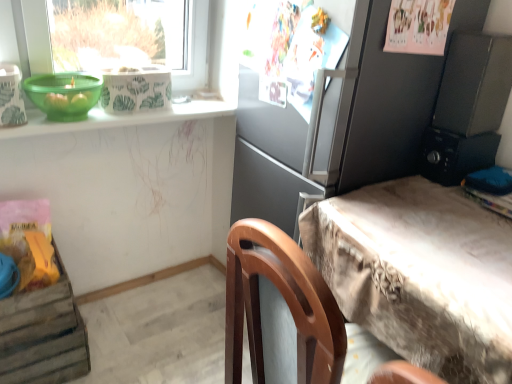
What are the coordinates of `matte gray refrigerator at center` in the screenshot? It's located at (346, 132).

Locate an element on the screen. Image resolution: width=512 pixels, height=384 pixels. textured beige desk at right is located at coordinates (420, 274).

What do you see at coordinates (64, 94) in the screenshot? I see `green plastic bowl at upper left` at bounding box center [64, 94].

This screenshot has height=384, width=512. What do you see at coordinates (455, 155) in the screenshot?
I see `black plastic radio at upper right` at bounding box center [455, 155].

Find the location of a particular element. Image resolution: width=512 pixels, height=384 pixels. matte gray refrigerator at center is located at coordinates (346, 132).

In the scene shown: From a real-world perspective, who is located lower, black plastic radio at upper right or green plastic bowl at upper left?

In real-world perspective, black plastic radio at upper right is lower.

At what (x,y) coordinates should I click in order to perform the action: click on appliance on the right of green plastic bowl at upper left. Please return your answer as a coordinate pair (x, y). Looking at the image, I should click on (455, 155).

How many degrees apart are the facing directions of black plastic radio at upper right and green plastic bowl at upper left?

They differ by 98.5 degrees in their facing directions.

Between black plastic radio at upper right and green plastic bowl at upper left, which one has larger width?

With larger width is black plastic radio at upper right.

Is matte gray refrigerator at center shorter than green plastic bowl at upper left?

Incorrect, the height of matte gray refrigerator at center does not fall short of that of green plastic bowl at upper left.

Is matte gray refrigerator at center spatially inside green plastic bowl at upper left, or outside of it?

matte gray refrigerator at center is spatially situated outside green plastic bowl at upper left.

Can you tell me how much matte gray refrigerator at center and green plastic bowl at upper left differ in facing direction?

91.3 degrees separate the facing orientations of matte gray refrigerator at center and green plastic bowl at upper left.

Who is more distant, matte gray refrigerator at center or green plastic bowl at upper left?

green plastic bowl at upper left.

In terms of width, does wooden crate at lower left look wider or thinner when compared to green plastic bowl at upper left?

wooden crate at lower left is wider than green plastic bowl at upper left.

This screenshot has width=512, height=384. I want to click on shelf located below the green plastic bowl at upper left (from the image's perspective), so click(42, 335).

Based on the photo, which object is closer to the camera, wooden crate at lower left or green plastic bowl at upper left?

green plastic bowl at upper left is more forward.

Is green plastic bowl at upper left positioned before wooden crate at lower left?

Yes.

How distant is green plastic bowl at upper left from wooden crate at lower left?

green plastic bowl at upper left and wooden crate at lower left are 28.84 inches apart.

Based on their sizes in the image, would you say green plastic bowl at upper left is bigger or smaller than wooden crate at lower left?

In the image, green plastic bowl at upper left appears to be smaller than wooden crate at lower left.

Is green plastic bowl at upper left positioned with its back to wooden crate at lower left?

No, green plastic bowl at upper left's orientation is not away from wooden crate at lower left.

From the image's perspective, between textured beige desk at right and black plastic radio at upper right, which one is located above?

From the image's view, black plastic radio at upper right is above.

Is textured beige desk at right positioned behind black plastic radio at upper right?

No, textured beige desk at right is closer to the viewer.

Identify the location of appliance located on the right of textured beige desk at right. (455, 155).

Does wooden crate at lower left touch green plastic bowl at upper left?

No, wooden crate at lower left is not with green plastic bowl at upper left.

Does wooden crate at lower left have a lesser width compared to green plastic bowl at upper left?

No.

Can you confirm if wooden crate at lower left is shorter than green plastic bowl at upper left?

In fact, wooden crate at lower left may be taller than green plastic bowl at upper left.

From a real-world perspective, which is physically above, wooden crate at lower left or green plastic bowl at upper left?

green plastic bowl at upper left, from a real-world perspective.

Which is behind, green plastic bowl at upper left or matte gray refrigerator at center?

green plastic bowl at upper left is further from the camera.

From the image's perspective, does green plastic bowl at upper left appear lower than matte gray refrigerator at center?

Actually, green plastic bowl at upper left appears above matte gray refrigerator at center in the image.

Which is closer, (x=163, y=115) or (x=323, y=102)?

Point (x=163, y=115) is farther from the camera than point (x=323, y=102).

This screenshot has width=512, height=384. Identify the location of cabinetry beneath the green plastic bowl at upper left (from a real-world perspective). (346, 132).

The height and width of the screenshot is (384, 512). I want to click on window sill above the black plastic radio at upper right (from the image's perspective), so click(119, 118).

Where is `window sill on the left side of matte gray refrigerator at center`? The image size is (512, 384). window sill on the left side of matte gray refrigerator at center is located at coordinates (119, 118).

Which object lies nearer to the anchor point matte gray refrigerator at center, black plastic radio at upper right or green plastic bowl at upper left?

The object closer to matte gray refrigerator at center is black plastic radio at upper right.

Considering their positions, is green plastic bowl at upper left positioned further to green plastic bowl at upper left than matte gray refrigerator at center?

matte gray refrigerator at center is further to green plastic bowl at upper left.

Looking at the image, which one is located further to green plastic bowl at upper left, green plastic bowl at upper left or textured beige desk at right?

Among the two, textured beige desk at right is located further to green plastic bowl at upper left.

Estimate the real-world distances between objects in this image. Which object is further from green plastic bowl at upper left, wooden crate at lower left or textured beige desk at right?

textured beige desk at right is positioned further to the anchor green plastic bowl at upper left.

Looking at the image, which one is located closer to wooden crate at lower left, green plastic bowl at upper left or green plastic bowl at upper left?

green plastic bowl at upper left is positioned closer to the anchor wooden crate at lower left.

In the scene shown: When comparing their distances from textured beige desk at right, does black plastic radio at upper right or matte gray refrigerator at center seem closer?

Among the two, matte gray refrigerator at center is located nearer to textured beige desk at right.

Looking at the image, which one is located closer to green plastic bowl at upper left, black plastic radio at upper right or wooden crate at lower left?

wooden crate at lower left is positioned closer to the anchor green plastic bowl at upper left.

Considering their positions, is black plastic radio at upper right positioned closer to matte gray refrigerator at center than textured beige desk at right?

The object closer to matte gray refrigerator at center is black plastic radio at upper right.

Find the location of a particular element. This screenshot has height=384, width=512. cabinetry located between wooden crate at lower left and black plastic radio at upper right in the left-right direction is located at coordinates (346, 132).

This screenshot has height=384, width=512. Find the location of `bowl situated between wooden crate at lower left and black plastic radio at upper right from left to right`. bowl situated between wooden crate at lower left and black plastic radio at upper right from left to right is located at coordinates (64, 94).

The height and width of the screenshot is (384, 512). What are the coordinates of `cabinetry between textured beige desk at right and black plastic radio at upper right along the z-axis` in the screenshot? It's located at (346, 132).

The image size is (512, 384). In order to click on cabinetry between wooden crate at lower left and textured beige desk at right from left to right in this screenshot , I will do `click(346, 132)`.